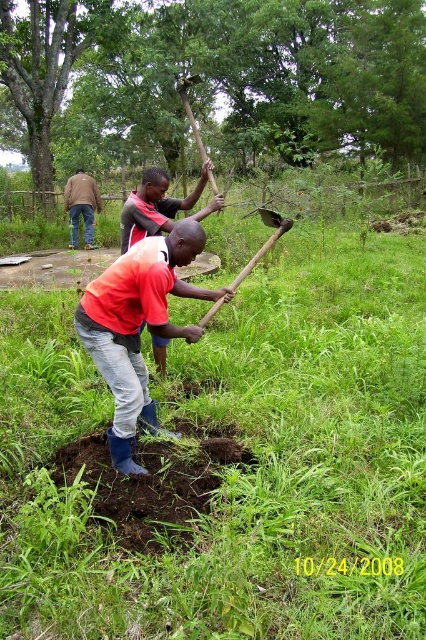
You are standing at the origin point in the image. Which direction should you move to reach the red shirt at center?

The red shirt at center is located at point 0.323 on the x and 0.362 on the y, so you should move towards the right and forward to reach it.

Based on the coordinates provided, which object is located at point (x=154, y=205) in the image?

The point (x=154, y=205) corresponds to the red shirt at center.